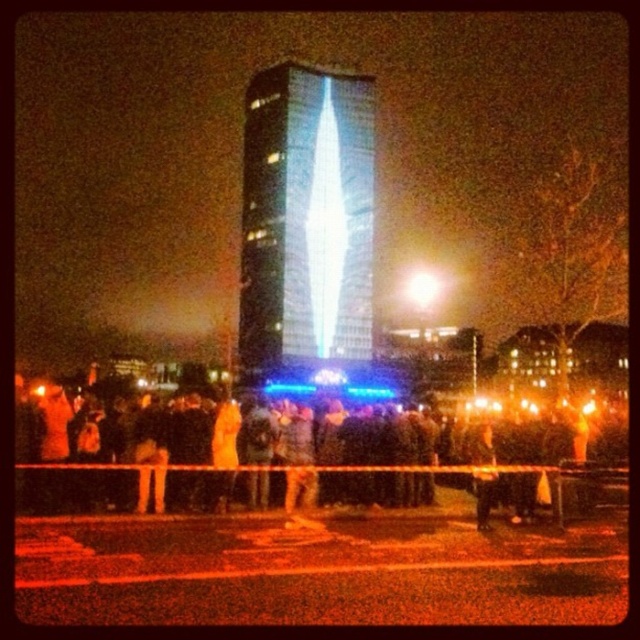
Question: Can you confirm if black fabric crowd at center is bigger than transparent glass tower at center?

Choices:
 (A) yes
 (B) no

Answer: (A)

Question: Can you confirm if black fabric crowd at center is bigger than transparent glass tower at center?

Choices:
 (A) yes
 (B) no

Answer: (A)

Question: Does black fabric crowd at center come behind transparent glass tower at center?

Choices:
 (A) yes
 (B) no

Answer: (B)